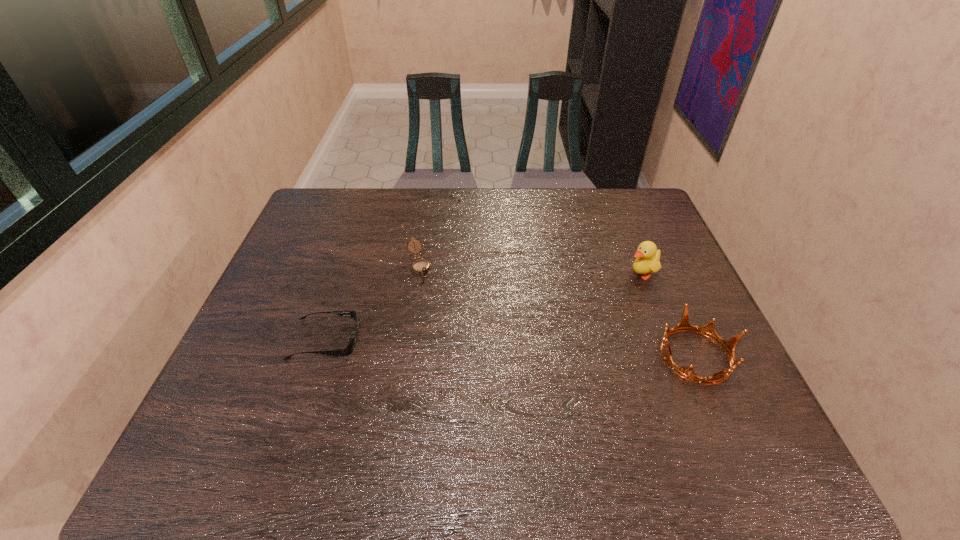
I want to click on free space located 0.070m on the front-facing side of the tallest object, so click(x=611, y=286).

Identify the location of vacant region located 0.240m on the face of the second shortest object. This screenshot has width=960, height=540. (448, 341).

At what (x,y) coordinates should I click in order to perform the action: click on vacant region located on the face of the second shortest object. Please return your answer as a coordinate pair (x, y). This screenshot has height=540, width=960. Looking at the image, I should click on (439, 318).

Identify the location of free space located 0.220m on the face of the second shortest object. (445, 335).

At what (x,y) coordinates should I click in order to perform the action: click on object located at the near edge. Please return your answer as a coordinate pair (x, y). Image resolution: width=960 pixels, height=540 pixels. Looking at the image, I should click on [708, 330].

Locate an element on the screen. The width and height of the screenshot is (960, 540). object that is at the left edge is located at coordinates (346, 351).

Locate an element on the screen. crown at the right edge is located at coordinates (708, 330).

Locate an element on the screen. The height and width of the screenshot is (540, 960). duckling at the right edge is located at coordinates (647, 256).

Locate an element on the screen. This screenshot has width=960, height=540. object that is at the near right corner is located at coordinates (708, 330).

In the image, there is a desktop. Where is `vacant area at the far edge`? This screenshot has height=540, width=960. vacant area at the far edge is located at coordinates (570, 228).